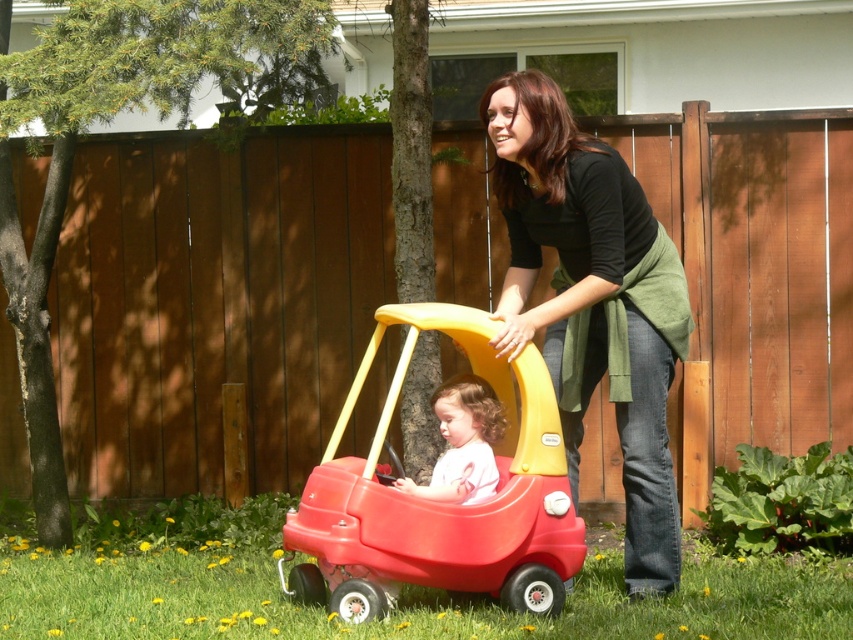
You are a child who wants to place both the black matte shirt at center and the red plastic toy car at center on a shelf that can only hold items narrower than the toy car. Which item can you place on the shelf?

The black matte shirt at center can be placed on the shelf because its width is less than the red plastic toy car at center, making it narrower and thus eligible for the shelf.

You are a child playing in the backyard and you see the black matte shirt at center and the red plastic toy car at center. Which object is taller?

The black matte shirt at center is taller than the red plastic toy car at center.